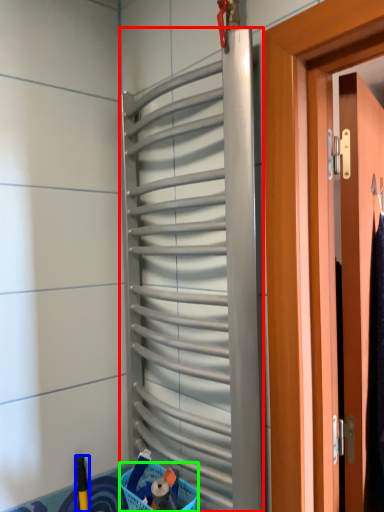
Question: Estimate the real-world distances between objects in this image. Which object is closer to shutter (highlighted by a red box), brush (highlighted by a blue box) or basket (highlighted by a green box)?

Choices:
 (A) brush
 (B) basket

Answer: (B)